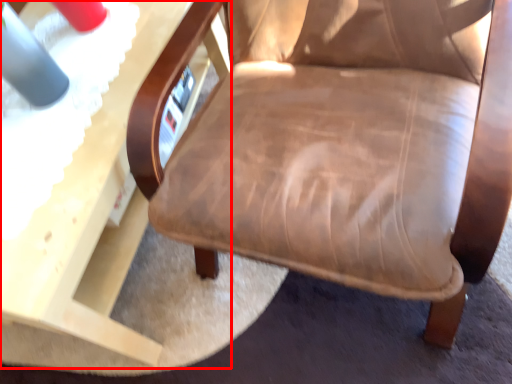
Question: From the image's perspective, what is the correct spatial positioning of table (annotated by the red box) in reference to chair?

Choices:
 (A) above
 (B) below

Answer: (B)